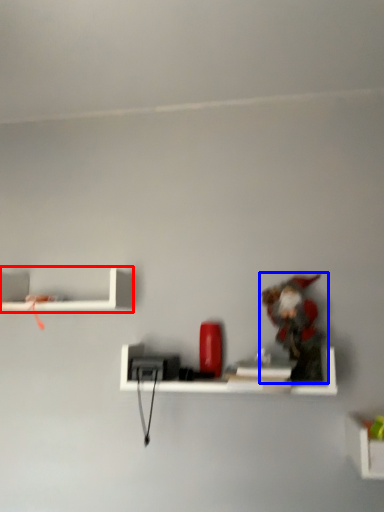
Question: Which object is further to the camera taking this photo, shelf (highlighted by a red box) or toy (highlighted by a blue box)?

Choices:
 (A) shelf
 (B) toy

Answer: (A)